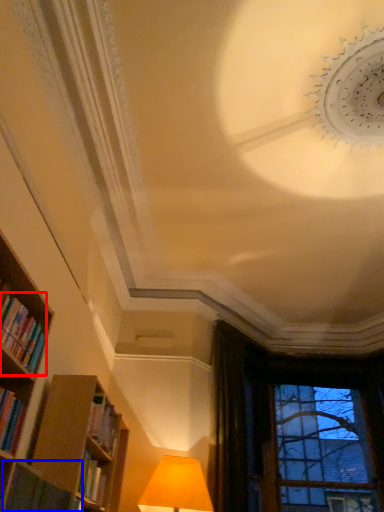
Question: Which object appears farthest to the camera in this image, book (highlighted by a red box) or book (highlighted by a blue box)?

Choices:
 (A) book
 (B) book

Answer: (B)